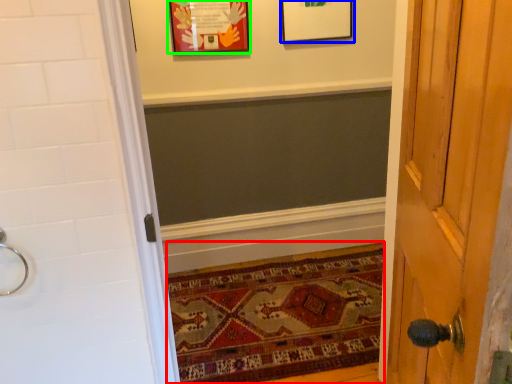
Question: Which object is the closest to the mat (highlighted by a red box)? Choose among these: picture frame (highlighted by a blue box) or picture frame (highlighted by a green box).

Choices:
 (A) picture frame
 (B) picture frame

Answer: (B)